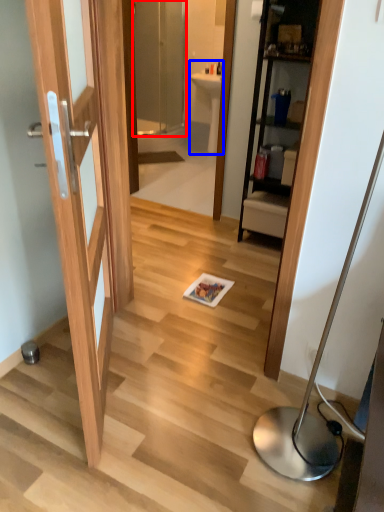
Question: Which object is closer to the camera taking this photo, screen door (highlighted by a red box) or sink (highlighted by a blue box)?

Choices:
 (A) screen door
 (B) sink

Answer: (A)